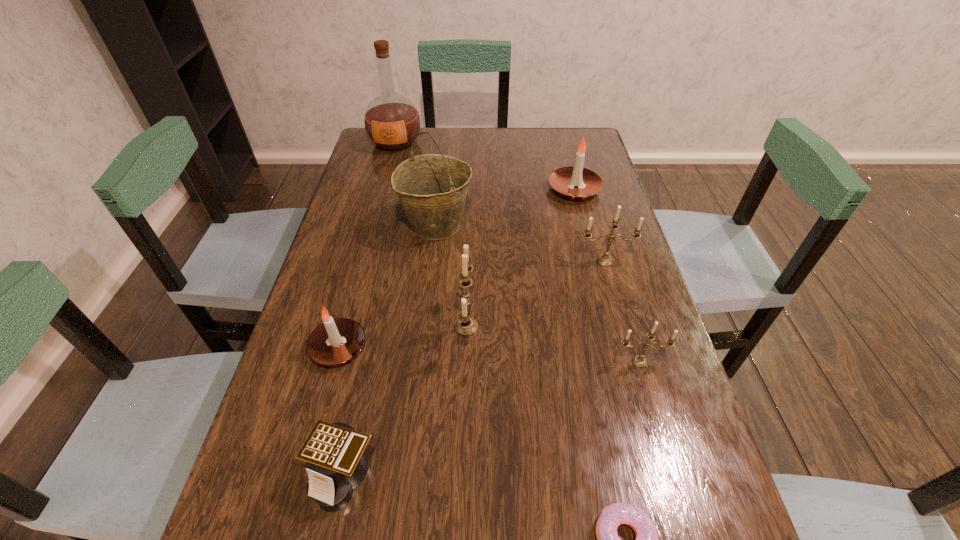
The image size is (960, 540). I want to click on the nearer white candle, so click(x=335, y=341).

At what (x,y) coordinates should I click in order to perform the action: click on the smallest metallic candle. Please return your answer as a coordinate pair (x, y). Looking at the image, I should click on (639, 361).

Find the location of a particular element. The height and width of the screenshot is (540, 960). calculator is located at coordinates (335, 452).

The width and height of the screenshot is (960, 540). I want to click on vacant space located on the front label of the liquor, so click(x=380, y=200).

In order to click on free space located on the front of the wine bucket in this screenshot , I will do `click(423, 350)`.

The image size is (960, 540). In order to click on free region located on the back of the third tallest object in this screenshot , I will do (x=469, y=233).

Identify the location of vacant area situated on the front of the right white candle. (590, 253).

Locate an element on the screen. Image resolution: width=960 pixels, height=540 pixels. vacant space positioned on the left of the fourth farthest object is located at coordinates (542, 261).

Identify the location of free point located on the front of the smaller white candle. The width and height of the screenshot is (960, 540). (294, 512).

The image size is (960, 540). What are the coordinates of `free region located on the back of the smallest metallic candle` in the screenshot? It's located at (623, 306).